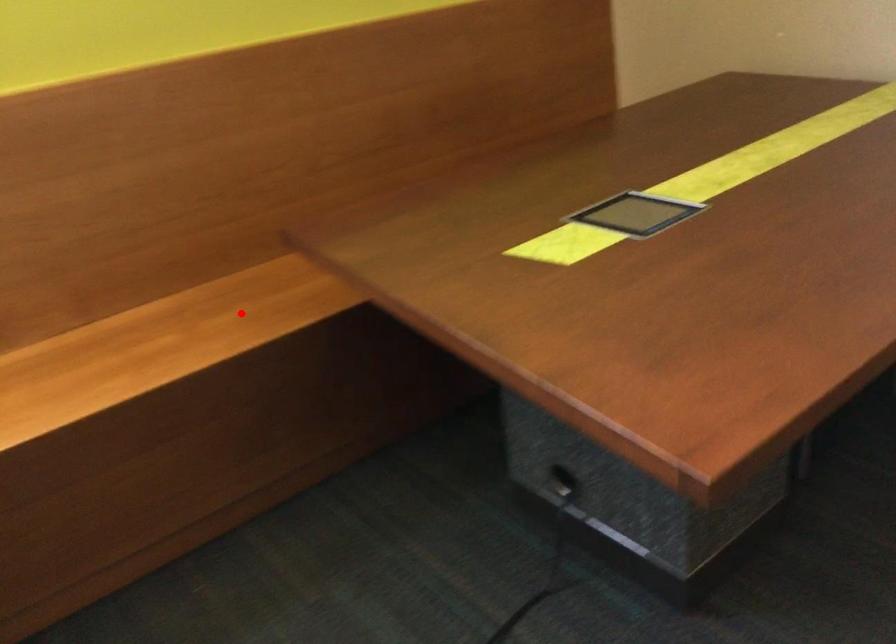
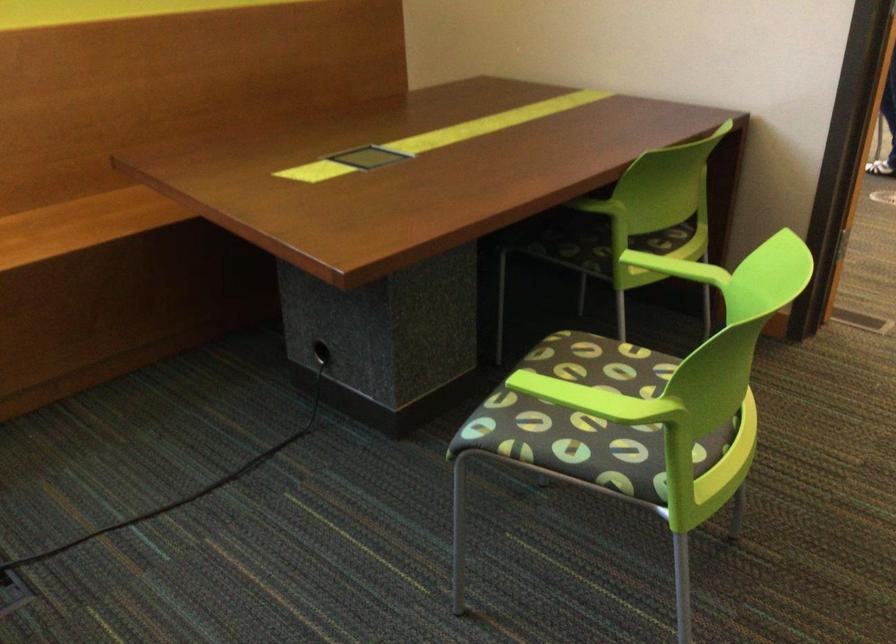
Locate, in the second image, the point that corresponds to the highlighted location in the first image.

(80, 223)